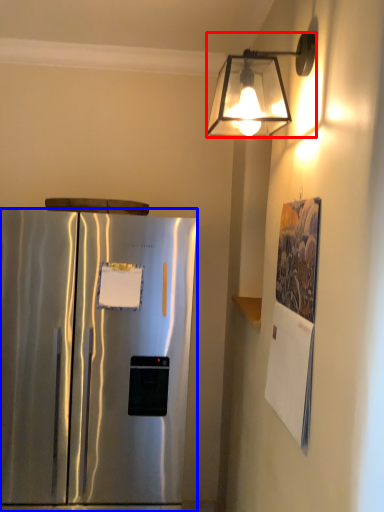
Question: Which point is further to the camera, lamp (highlighted by a red box) or refrigerator (highlighted by a blue box)?

Choices:
 (A) lamp
 (B) refrigerator

Answer: (B)